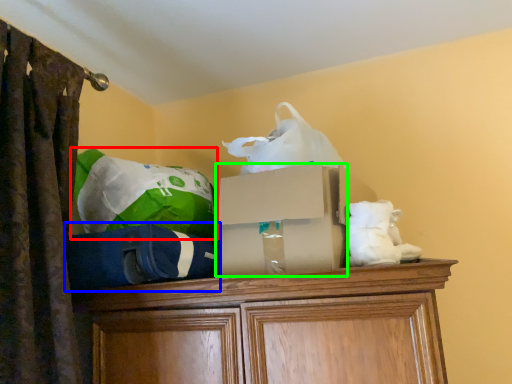
Question: Based on their relative distances, which object is farther from bean bag chair (highlighted by a red box)? Choose from bean bag chair (highlighted by a blue box) and storage box (highlighted by a green box).

Choices:
 (A) bean bag chair
 (B) storage box

Answer: (B)